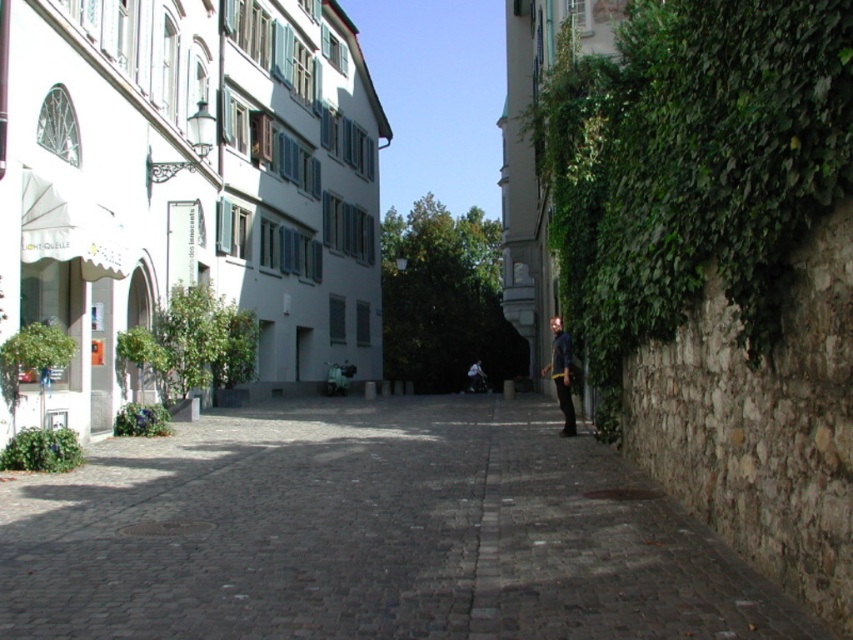
From the picture: Which is more to the right, dark gray cobblestone at center or dark blue denim jacket at right?

dark blue denim jacket at right is more to the right.

Is dark gray cobblestone at center taller than dark blue denim jacket at right?

No, dark gray cobblestone at center is not taller than dark blue denim jacket at right.

This screenshot has width=853, height=640. I want to click on dark gray cobblestone at center, so click(369, 536).